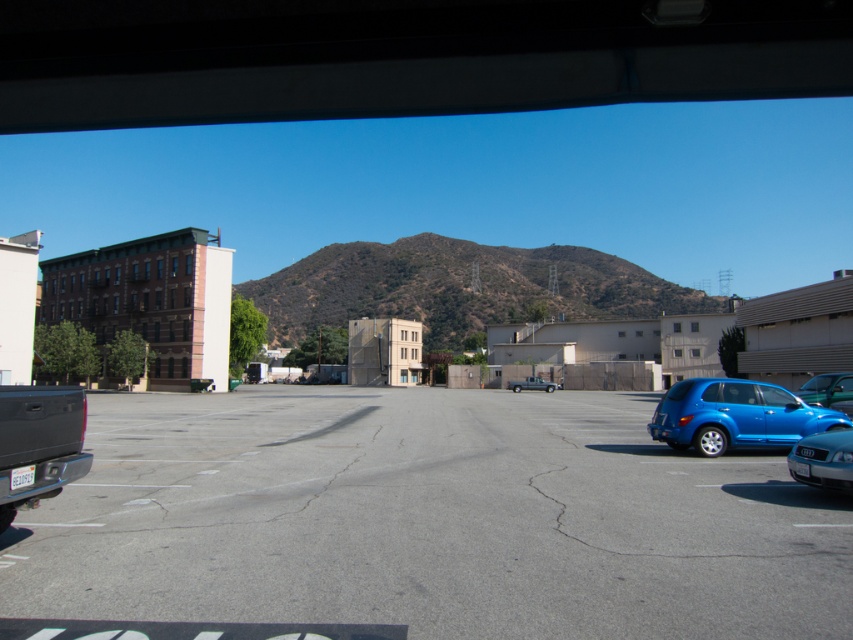
Question: Does green grassy hill at center appear on the left side of blue matte hatchback at right?

Choices:
 (A) yes
 (B) no

Answer: (A)

Question: Can you confirm if blue matte car at lower right is positioned above silver metallic sedan at lower right?

Choices:
 (A) no
 (B) yes

Answer: (A)

Question: Which object is farther from the camera taking this photo?

Choices:
 (A) blue matte hatchback at right
 (B) metallic silver truck at center
 (C) matte black truck at lower left
 (D) silver metallic sedan at lower right

Answer: (B)

Question: Which object is farther from the camera taking this photo?

Choices:
 (A) green grassy hill at center
 (B) metallic silver truck at center
 (C) blue matte hatchback at right
 (D) silver metallic sedan at lower right

Answer: (B)

Question: Does asphalt at center come behind silver metallic sedan at lower right?

Choices:
 (A) no
 (B) yes

Answer: (A)

Question: Which point appears closest to the camera in this image?

Choices:
 (A) [36, 438]
 (B) [804, 388]
 (C) [515, 387]
 (D) [796, 460]

Answer: (A)